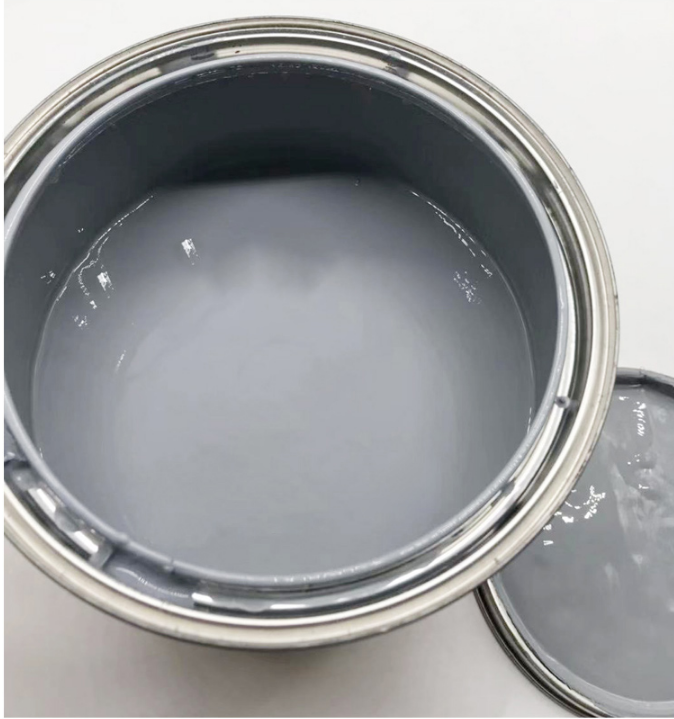
Where is `gray paint`? The width and height of the screenshot is (674, 719). gray paint is located at coordinates (309, 298).